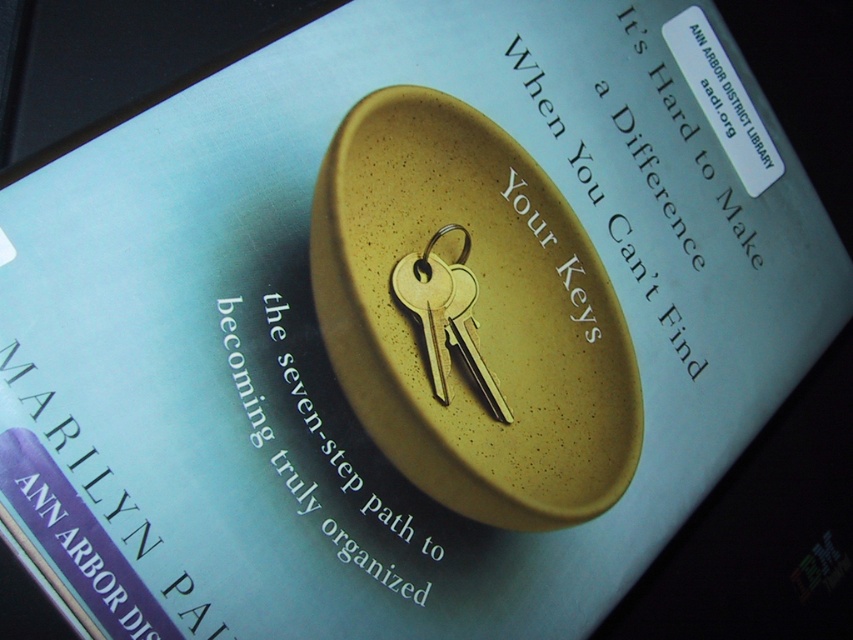
Can you confirm if goldspeckledkey ring and key at center is bigger than gold metallic key at center?

Correct, goldspeckledkey ring and key at center is larger in size than gold metallic key at center.

Can you confirm if goldspeckledkey ring and key at center is positioned to the right of gold metallic key at center?

Correct, you'll find goldspeckledkey ring and key at center to the right of gold metallic key at center.

Does point (544, 314) lie behind point (473, 362)?

Yes, it is behind point (473, 362).

Where is `goldspeckledkey ring and key at center`? The width and height of the screenshot is (853, 640). goldspeckledkey ring and key at center is located at coordinates (471, 316).